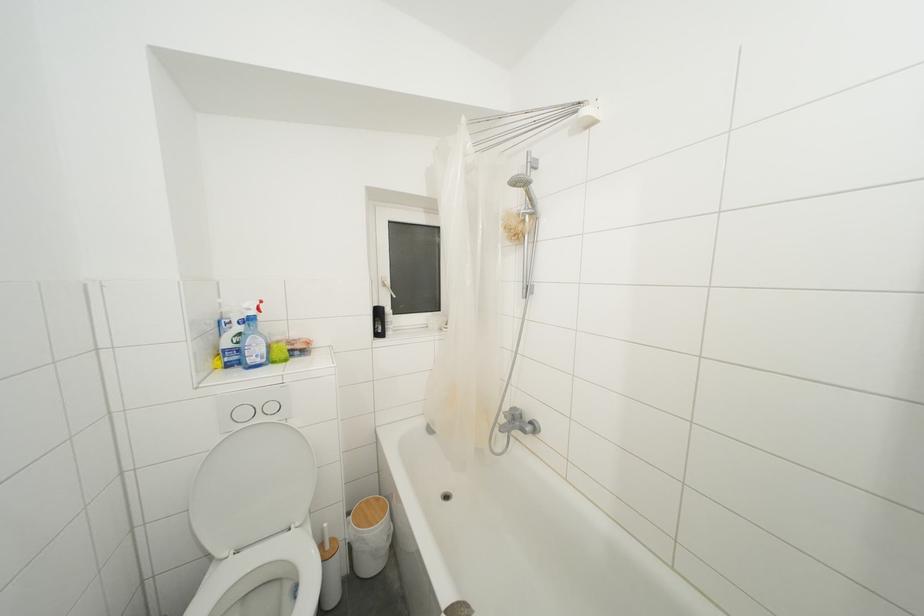
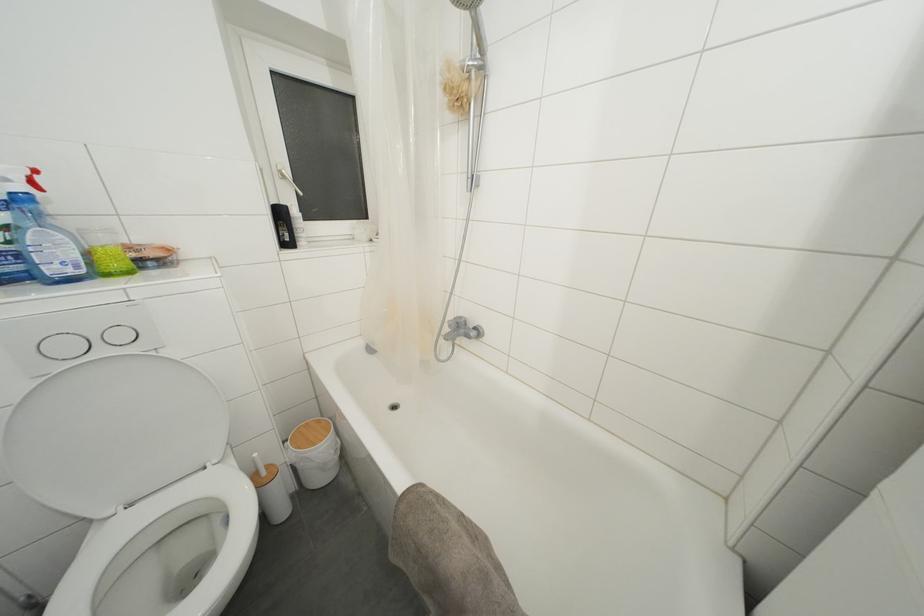
Question: How did the camera likely rotate?

Choices:
 (A) Left
 (B) Right
 (C) Up
 (D) Down

Answer: (D)